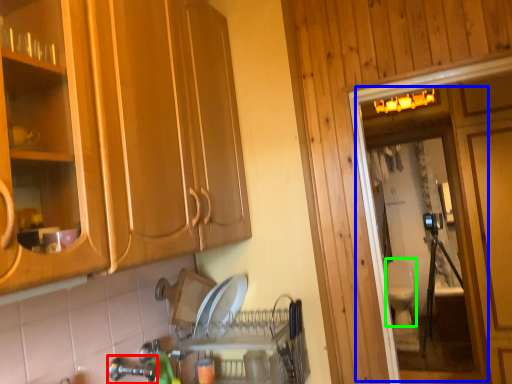
Question: Considering the real-world distances, which object is farthest from faucet (highlighted by a red box)? screen door (highlighted by a blue box) or toilet bowl (highlighted by a green box)?

Choices:
 (A) screen door
 (B) toilet bowl

Answer: (B)